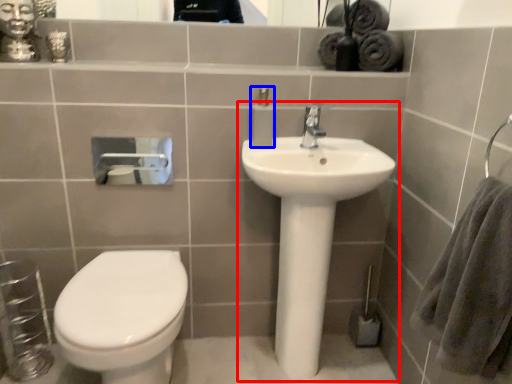
Question: Which of the following is the closest to the observer, sink (highlighted by a red box) or soap dispenser (highlighted by a blue box)?

Choices:
 (A) sink
 (B) soap dispenser

Answer: (A)